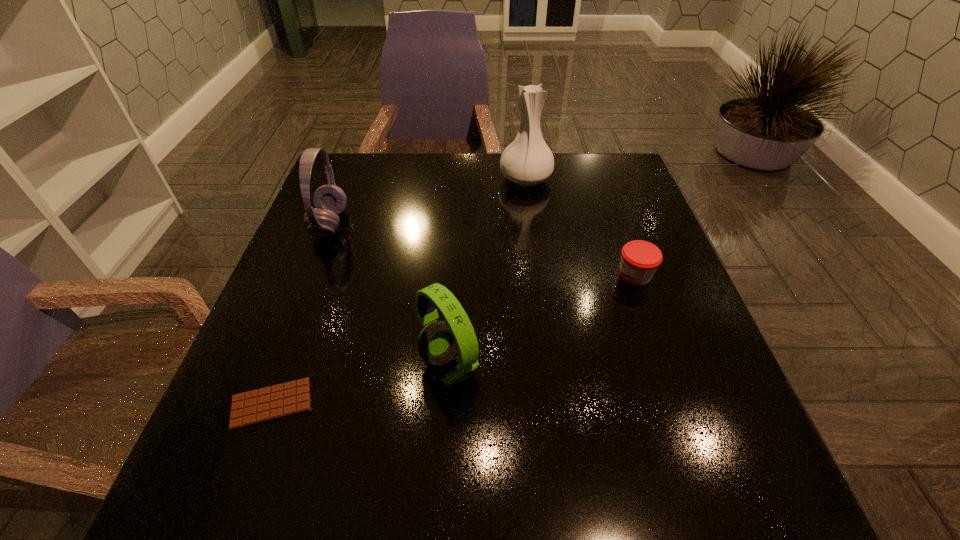
Image resolution: width=960 pixels, height=540 pixels. What are the coordinates of `vacant space located 0.350m on the headband and ear cups of the left headset` in the screenshot? It's located at (486, 224).

Where is `free space located 0.110m on the left of the third object from right to left`? The height and width of the screenshot is (540, 960). free space located 0.110m on the left of the third object from right to left is located at coordinates (359, 366).

Locate an element on the screen. vacant space located 0.190m on the label side of the third nearest object is located at coordinates (530, 275).

Identify the location of free region located on the label side of the third nearest object. (535, 275).

Locate an element on the screen. vacant space located 0.300m on the label side of the third nearest object is located at coordinates (480, 275).

Where is `vacant space located 0.180m on the back of the shortest object`? This screenshot has width=960, height=540. vacant space located 0.180m on the back of the shortest object is located at coordinates (308, 303).

The image size is (960, 540). I want to click on object located at the far edge, so click(527, 161).

At what (x,y) coordinates should I click in order to perform the action: click on headset that is positioned at the left edge. Please return your answer as a coordinate pair (x, y). The width and height of the screenshot is (960, 540). Looking at the image, I should click on (329, 200).

The width and height of the screenshot is (960, 540). In order to click on candy bar present at the left edge in this screenshot , I will do `click(253, 407)`.

Locate an element on the screen. The height and width of the screenshot is (540, 960). object at the right edge is located at coordinates (640, 259).